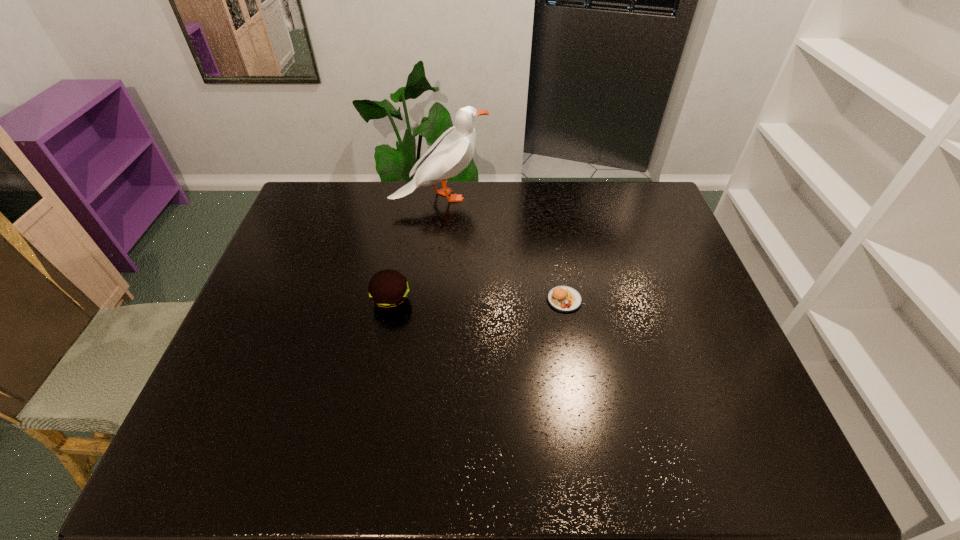
This screenshot has height=540, width=960. In order to click on free space at the far edge of the desktop in this screenshot , I will do `click(506, 212)`.

Find the location of a particular element. Image resolution: width=960 pixels, height=540 pixels. vacant region at the near edge is located at coordinates (399, 467).

The width and height of the screenshot is (960, 540). Find the location of `free region at the left edge`. free region at the left edge is located at coordinates [x=310, y=299].

Where is `vacant space at the right edge of the desktop`? Image resolution: width=960 pixels, height=540 pixels. vacant space at the right edge of the desktop is located at coordinates (717, 384).

The width and height of the screenshot is (960, 540). In order to click on vacant space at the far left corner of the desktop in this screenshot , I will do `click(296, 210)`.

Find the location of a particular element. free space that is in between the gull and the right patty is located at coordinates (502, 248).

The width and height of the screenshot is (960, 540). I want to click on free space between the left patty and the tallest object, so click(x=416, y=249).

Locate an element on the screen. free spot between the taller patty and the gull is located at coordinates (416, 249).

Identify the location of free point between the rightmost object and the second tallest object. (478, 300).

Identify the location of unoccupied position between the taller patty and the farthest object. (416, 249).